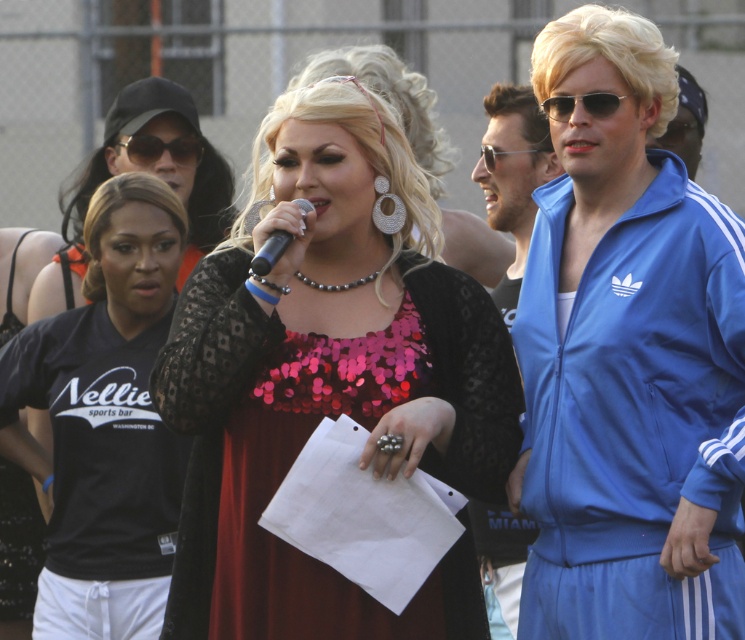
Who is positioned more to the left, black sequined dress at center or black plastic microphone at center?

Positioned to the left is black sequined dress at center.

Find the location of a particular element. black sequined dress at center is located at coordinates (104, 420).

Which is behind, point (57, 536) or point (589, 100)?

The point (57, 536) is behind.

Who is more forward, [114,456] or [609,93]?

Point [609,93] is in front.

Find the location of `black sequined dress at center`. black sequined dress at center is located at coordinates (104, 420).

Is sequined fabric dress at center thinner than black sequined dress at center?

No.

Which is more to the left, sequined fabric dress at center or black sequined dress at center?

black sequined dress at center is more to the left.

Image resolution: width=745 pixels, height=640 pixels. What are the coordinates of `sequined fabric dress at center` in the screenshot? It's located at (329, 387).